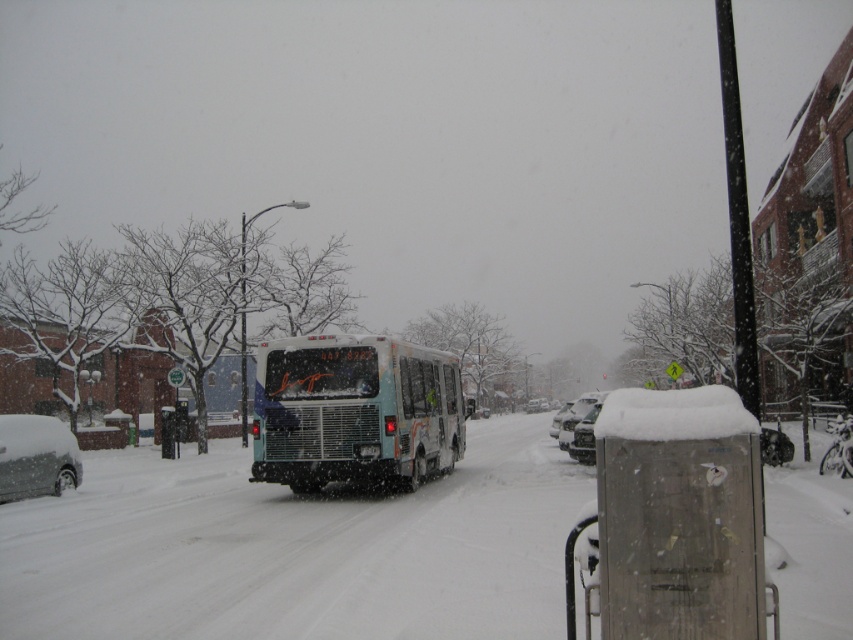
Question: Which point is farther from the camera taking this photo?

Choices:
 (A) (601, 397)
 (B) (428, 356)

Answer: (A)

Question: Does matte black van at lower left come behind snow-covered sedan at center?

Choices:
 (A) yes
 (B) no

Answer: (B)

Question: Can you confirm if white matte bus at center is wider than matte black van at lower left?

Choices:
 (A) yes
 (B) no

Answer: (A)

Question: Among these points, which one is farthest from the camera?

Choices:
 (A) (583, 419)
 (B) (39, 465)

Answer: (A)

Question: Considering the real-world distances, which object is farthest from the white matte bus at center?

Choices:
 (A) matte black van at lower left
 (B) snow-covered sedan at center

Answer: (A)

Question: Is white matte bus at center thinner than snow-covered sedan at center?

Choices:
 (A) yes
 (B) no

Answer: (B)